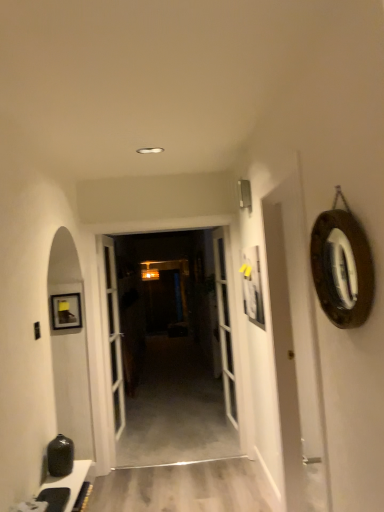
Question: Is wooden at center beside white glass door at center, acting as the second door starting from the left?

Choices:
 (A) yes
 (B) no

Answer: (B)

Question: Is white glass door at center, the first door viewed from the right, a part of wooden at center?

Choices:
 (A) yes
 (B) no

Answer: (B)

Question: Does wooden at center have a lesser width compared to white glass door at center, the first door viewed from the right?

Choices:
 (A) yes
 (B) no

Answer: (A)

Question: Considering the relative sizes of wooden at center and white glass door at center, acting as the second door starting from the left, in the image provided, is wooden at center taller than white glass door at center, acting as the second door starting from the left,?

Choices:
 (A) no
 (B) yes

Answer: (A)

Question: From the image's perspective, is wooden at center located beneath white glass door at center, the first door viewed from the right?

Choices:
 (A) no
 (B) yes

Answer: (B)

Question: From a real-world perspective, is wooden at center located beneath white glass door at center, acting as the second door starting from the left?

Choices:
 (A) yes
 (B) no

Answer: (B)

Question: Is wooden-framed mirror at right smaller than wooden at center?

Choices:
 (A) yes
 (B) no

Answer: (A)

Question: Is wooden-framed mirror at right turned away from wooden at center?

Choices:
 (A) no
 (B) yes

Answer: (A)

Question: From a real-world perspective, is wooden-framed mirror at right physically above wooden at center?

Choices:
 (A) yes
 (B) no

Answer: (A)

Question: Is wooden-framed mirror at right to the right of wooden at center from the viewer's perspective?

Choices:
 (A) no
 (B) yes

Answer: (B)

Question: Is the depth of wooden-framed mirror at right greater than that of wooden at center?

Choices:
 (A) yes
 (B) no

Answer: (B)

Question: Is wooden-framed mirror at right beside wooden at center?

Choices:
 (A) yes
 (B) no

Answer: (B)

Question: Considering the relative sizes of wooden at center and white glossy door at center, positioned as the 2th door in right-to-left order, in the image provided, is wooden at center taller than white glossy door at center, positioned as the 2th door in right-to-left order,?

Choices:
 (A) yes
 (B) no

Answer: (B)